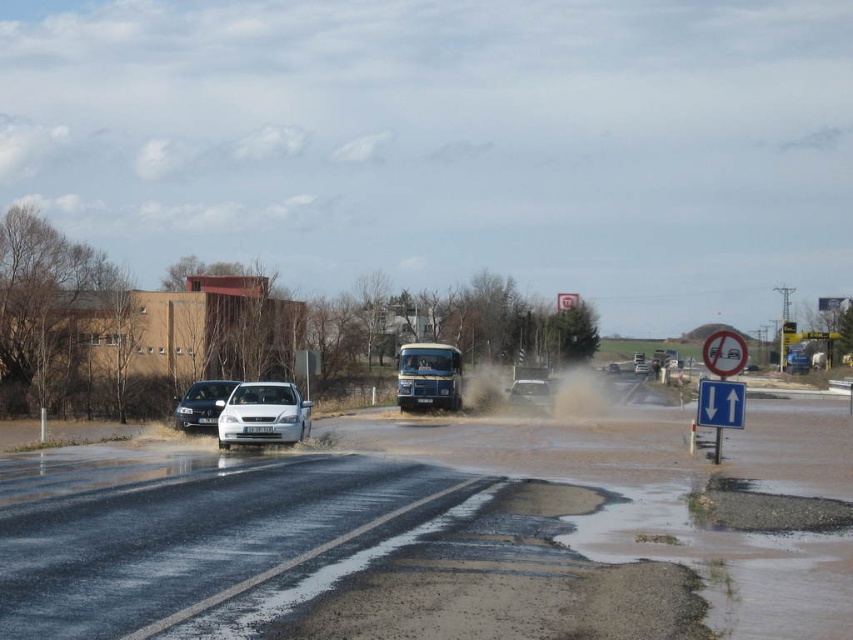
Question: Is metallic silver bus at center to the right of satin white sedan at left from the viewer's perspective?

Choices:
 (A) no
 (B) yes

Answer: (B)

Question: Which point is closer to the camera taking this photo?

Choices:
 (A) (457, 371)
 (B) (708, 355)
 (C) (175, 408)

Answer: (B)

Question: Can you confirm if white glossy sedan at center is thinner than blue plastic sign at center right?

Choices:
 (A) no
 (B) yes

Answer: (A)

Question: Does metallic silver bus at center lie behind blue plastic sign at center right?

Choices:
 (A) yes
 (B) no

Answer: (A)

Question: Which object appears farthest from the camera in this image?

Choices:
 (A) metallic silver bus at center
 (B) satin white sedan at left
 (C) blue plastic sign at center right

Answer: (A)

Question: Which is farther from the blue plastic sign at center right?

Choices:
 (A) matte silver suv at center
 (B) white plastic sign at center
 (C) white plastic sign at upper center
 (D) metallic silver bus at center

Answer: (C)